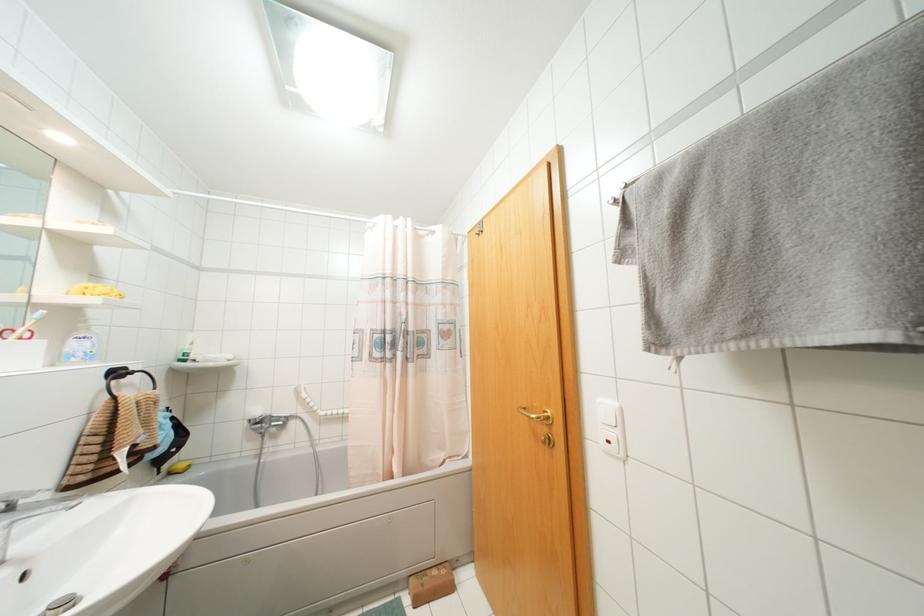
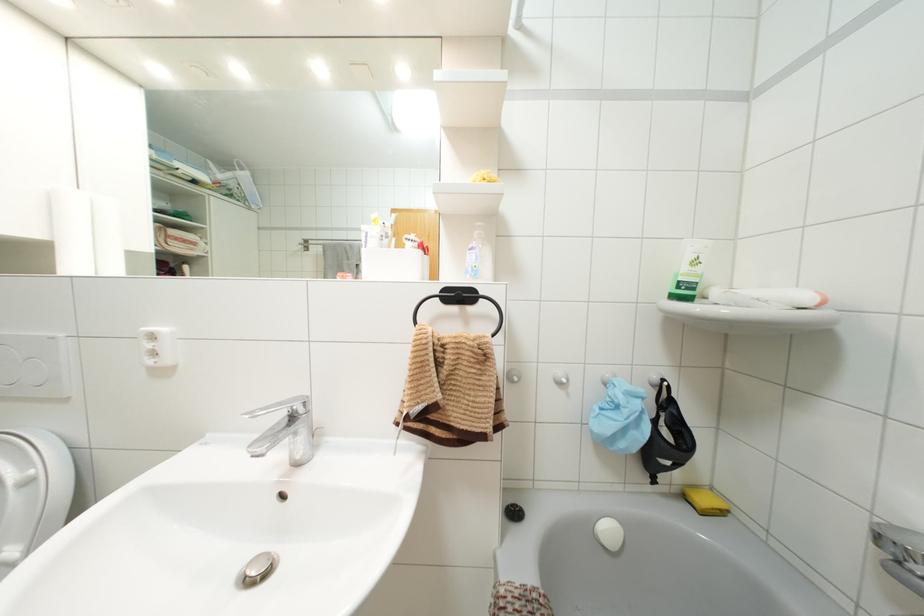
In the second image, find the point that corresponds to point (190, 342) in the first image.

(695, 262)